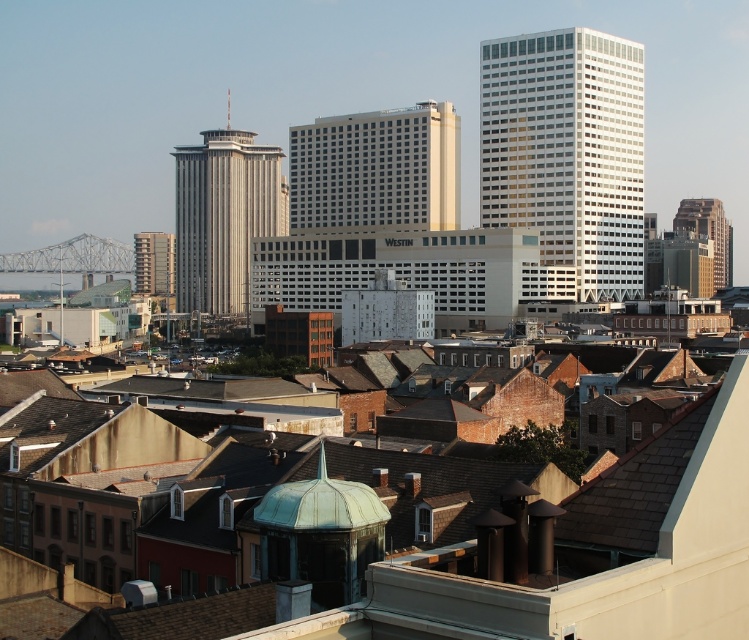
Consider the image. Does silver metallic skyscraper at center have a greater width compared to gold glass skyscraper at right?

Indeed, silver metallic skyscraper at center has a greater width compared to gold glass skyscraper at right.

Is silver metallic skyscraper at center taller than gold glass skyscraper at right?

Yes, silver metallic skyscraper at center is taller than gold glass skyscraper at right.

At what (x,y) coordinates should I click in order to perform the action: click on silver metallic skyscraper at center. Please return your answer as a coordinate pair (x, y). Looking at the image, I should click on (222, 216).

The width and height of the screenshot is (749, 640). I want to click on silver metallic skyscraper at center, so click(x=222, y=216).

Does silver metallic skyscraper at center have a greater height compared to matte gray building at center?

Yes, silver metallic skyscraper at center is taller than matte gray building at center.

Does silver metallic skyscraper at center have a lesser width compared to matte gray building at center?

No.

Is point (236, 145) closer to camera compared to point (175, 289)?

That is True.

Find the location of `silver metallic skyscraper at center`. silver metallic skyscraper at center is located at coordinates 222,216.

Which is more to the right, gold glass skyscraper at right or matte gray building at center?

From the viewer's perspective, gold glass skyscraper at right appears more on the right side.

Between gold glass skyscraper at right and matte gray building at center, which one is positioned higher?

Result: gold glass skyscraper at right is above.

Who is more distant from viewer, (709,205) or (160,252)?

The point (709,205) is behind.

Where is `gold glass skyscraper at right`? gold glass skyscraper at right is located at coordinates (709, 234).